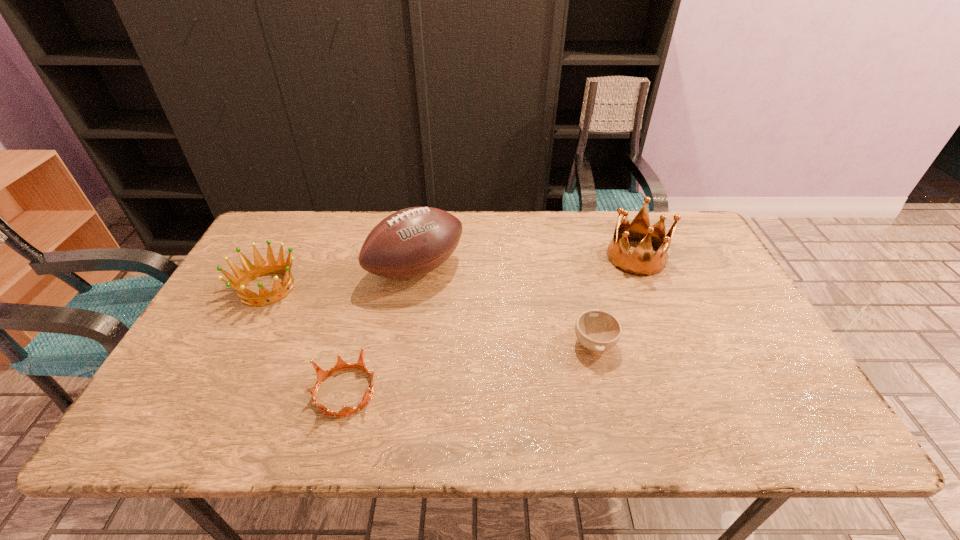
The width and height of the screenshot is (960, 540). I want to click on free space located on the right of the leftmost crown, so click(x=399, y=288).

Image resolution: width=960 pixels, height=540 pixels. Identify the location of vacant space located 0.060m on the front of the bowl. (605, 386).

Image resolution: width=960 pixels, height=540 pixels. I want to click on vacant space situated on the right of the shortest crown, so click(x=488, y=392).

This screenshot has height=540, width=960. In order to click on football (American) present at the far edge in this screenshot , I will do `click(411, 242)`.

Image resolution: width=960 pixels, height=540 pixels. I want to click on crown located at the far edge, so click(x=641, y=262).

The width and height of the screenshot is (960, 540). I want to click on object located in the near edge section of the desktop, so click(341, 364).

Locate an element on the screen. Image resolution: width=960 pixels, height=540 pixels. object that is at the left edge is located at coordinates (261, 267).

This screenshot has height=540, width=960. In order to click on object present at the right edge in this screenshot , I will do `click(641, 262)`.

Identify the location of object that is positioned at the far right corner. The height and width of the screenshot is (540, 960). (641, 262).

Identify the location of vacant position at the far edge of the desktop. (486, 248).